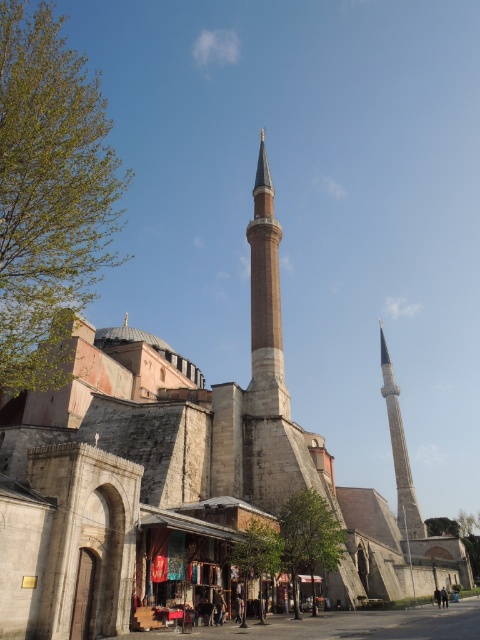
You are standing in front of the historic mosque complex and want to take a photo. You notice two points marked as point 1 and point 2. Point 1 is at coordinates point (261, 163) and point 2 is at point (391, 428). Which point will appear larger in your photo?

Point 1 is closer to the camera than point 2, so it will appear larger in the photo.

From the picture: You are an architect analyzing the mosque complex. You need to determine which minaret is narrower between the smooth stone minaret at center and the gray stone minaret at right. Which one is narrower?

The smooth stone minaret at center has a lesser width compared to the gray stone minaret at right, so the smooth stone minaret at center is narrower.

You are an architect analyzing the mosque complex. You notice the smooth stone minaret at center and the gray stone minaret at right. Which minaret is taller?

The smooth stone minaret at center is shorter than the gray stone minaret at right, so the gray stone minaret at right is taller.